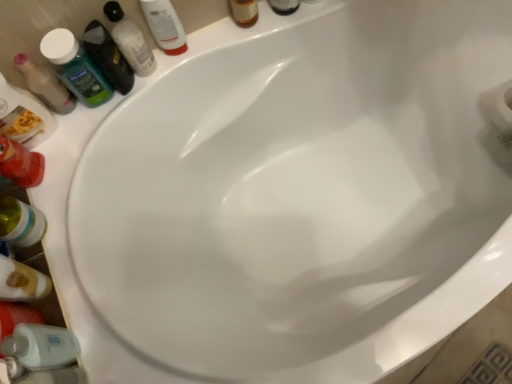
Question: Is green matte mouthwash at upper left, marked as the 3th mouthwash in a left-to-right arrangement, to the left of white glossy mouthwash at upper left, which is counted as the fourth mouthwash, starting from the left, from the viewer's perspective?

Choices:
 (A) yes
 (B) no

Answer: (A)

Question: Does green matte mouthwash at upper left, marked as the 3th mouthwash in a left-to-right arrangement, have a smaller size compared to white glossy mouthwash at upper left, which is counted as the fourth mouthwash, starting from the left?

Choices:
 (A) no
 (B) yes

Answer: (A)

Question: Considering the relative sizes of green matte mouthwash at upper left, placed as the second mouthwash when sorted from right to left, and white glossy mouthwash at upper left, placed as the 1th mouthwash when sorted from right to left, in the image provided, is green matte mouthwash at upper left, placed as the second mouthwash when sorted from right to left, taller than white glossy mouthwash at upper left, placed as the 1th mouthwash when sorted from right to left,?

Choices:
 (A) yes
 (B) no

Answer: (A)

Question: Is green matte mouthwash at upper left, marked as the 3th mouthwash in a left-to-right arrangement, completely or partially outside of white glossy mouthwash at upper left, placed as the 1th mouthwash when sorted from right to left?

Choices:
 (A) no
 (B) yes

Answer: (B)

Question: Does green matte mouthwash at upper left, marked as the 3th mouthwash in a left-to-right arrangement, lie in front of white glossy mouthwash at upper left, placed as the 1th mouthwash when sorted from right to left?

Choices:
 (A) no
 (B) yes

Answer: (B)

Question: From the image's perspective, is green matte mouthwash at upper left, marked as the 3th mouthwash in a left-to-right arrangement, located beneath white glossy mouthwash at upper left, placed as the 1th mouthwash when sorted from right to left?

Choices:
 (A) no
 (B) yes

Answer: (B)

Question: Is white glossy mouthwash at upper left, which is counted as the fourth mouthwash, starting from the left, aimed at translucent plastic shampoo bottle at upper left, arranged as the second toiletry when viewed from the right?

Choices:
 (A) no
 (B) yes

Answer: (A)

Question: Considering the relative sizes of white glossy mouthwash at upper left, placed as the 1th mouthwash when sorted from right to left, and translucent plastic shampoo bottle at upper left, which ranks as the 1th toiletry in left-to-right order, in the image provided, is white glossy mouthwash at upper left, placed as the 1th mouthwash when sorted from right to left, bigger than translucent plastic shampoo bottle at upper left, which ranks as the 1th toiletry in left-to-right order,?

Choices:
 (A) yes
 (B) no

Answer: (B)

Question: Can we say white glossy mouthwash at upper left, placed as the 1th mouthwash when sorted from right to left, lies outside translucent plastic shampoo bottle at upper left, which ranks as the 1th toiletry in left-to-right order?

Choices:
 (A) yes
 (B) no

Answer: (A)

Question: Is the depth of white glossy mouthwash at upper left, which is counted as the fourth mouthwash, starting from the left, greater than that of translucent plastic shampoo bottle at upper left, the second toiletry viewed from the top?

Choices:
 (A) yes
 (B) no

Answer: (A)

Question: Is white glossy mouthwash at upper left, placed as the 1th mouthwash when sorted from right to left, thinner than translucent plastic shampoo bottle at upper left, the first toiletry ordered from the bottom?

Choices:
 (A) yes
 (B) no

Answer: (A)

Question: Is white glossy mouthwash at upper left, which is counted as the fourth mouthwash, starting from the left, shorter than translucent plastic shampoo bottle at upper left, the first toiletry ordered from the bottom?

Choices:
 (A) no
 (B) yes

Answer: (A)

Question: Is translucent plastic mouthwash at upper left, which is the 1th mouthwash from left to right, positioned beyond the bounds of green matte mouthwash at upper left, placed as the second mouthwash when sorted from right to left?

Choices:
 (A) no
 (B) yes

Answer: (B)